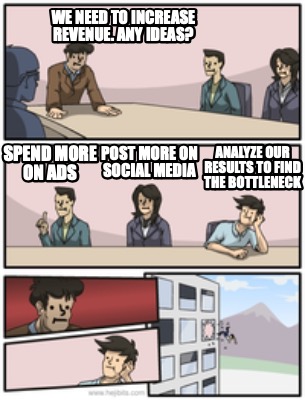
This screenshot has width=305, height=400. I want to click on blind, so click(210, 381), click(165, 331), click(188, 354), click(206, 352), click(188, 292), click(202, 293), click(171, 384).